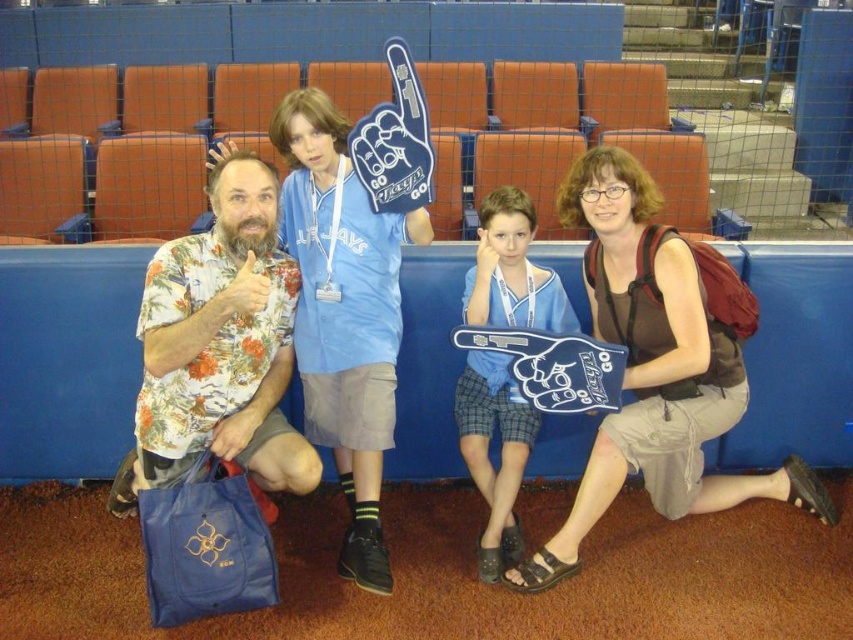
Does brown fabric backpack at lower right come in front of floral print shirt at left?

No, brown fabric backpack at lower right is further to the viewer.

Consider the image. Does brown fabric backpack at lower right have a smaller size compared to floral print shirt at left?

Actually, brown fabric backpack at lower right might be larger than floral print shirt at left.

Which is behind, point (595, 324) or point (242, 422)?

Positioned behind is point (595, 324).

At what (x,y) coordinates should I click in order to perform the action: click on brown fabric backpack at lower right. Please return your answer as a coordinate pair (x, y). Image resolution: width=853 pixels, height=640 pixels. Looking at the image, I should click on (659, 364).

Who is higher up, brown fabric backpack at lower right or blue fabric foam finger at center?

brown fabric backpack at lower right is above.

Which is more to the left, brown fabric backpack at lower right or blue fabric foam finger at center?

From the viewer's perspective, blue fabric foam finger at center appears more on the left side.

At what (x,y) coordinates should I click in order to perform the action: click on brown fabric backpack at lower right. Please return your answer as a coordinate pair (x, y). This screenshot has height=640, width=853. Looking at the image, I should click on (659, 364).

Find the location of a particular element. brown fabric backpack at lower right is located at coordinates (659, 364).

Between floral print shirt at left and blue fabric foam finger at center, which one appears on the left side from the viewer's perspective?

From the viewer's perspective, floral print shirt at left appears more on the left side.

Is floral print shirt at left to the left of blue fabric foam finger at center from the viewer's perspective?

Indeed, floral print shirt at left is positioned on the left side of blue fabric foam finger at center.

Which is in front, point (202, 259) or point (534, 268)?

Point (202, 259)

Find the location of a particular element. floral print shirt at left is located at coordinates (219, 346).